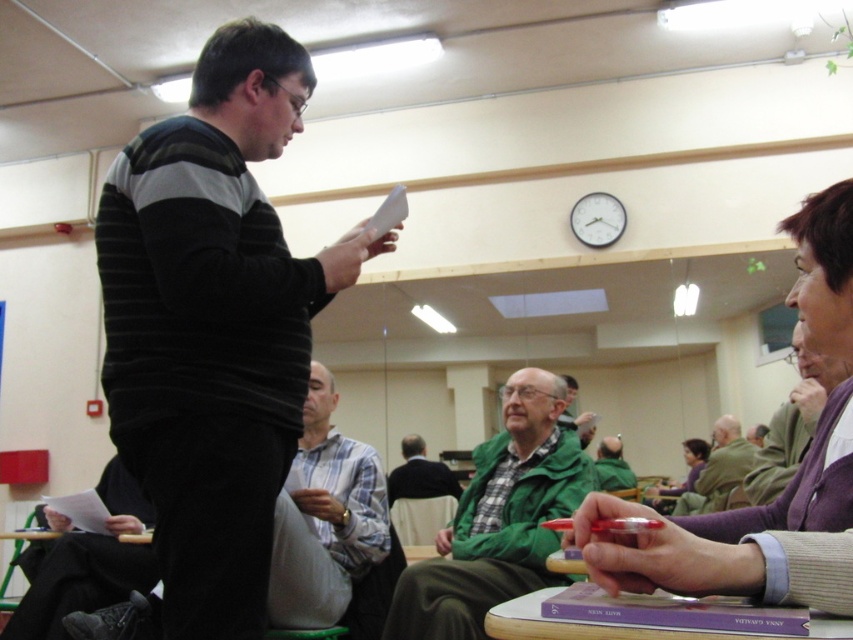
Question: Which point is closer to the camera taking this photo?

Choices:
 (A) (457, 573)
 (B) (322, 552)
 (C) (434, 497)

Answer: (A)

Question: Does green matte jacket at center have a larger size compared to green textured jacket at center?

Choices:
 (A) yes
 (B) no

Answer: (A)

Question: Based on their relative distances, which object is nearer to the green woolen sweater at center?

Choices:
 (A) striped sweater at center
 (B) white plaid shirt at center

Answer: (B)

Question: Does striped sweater at center come behind green textured jacket at center?

Choices:
 (A) yes
 (B) no

Answer: (B)

Question: Does green matte jacket at center have a larger size compared to white plaid shirt at center?

Choices:
 (A) no
 (B) yes

Answer: (B)

Question: Which object is farther from the camera taking this photo?

Choices:
 (A) green woolen sweater at center
 (B) white plaid shirt at center
 (C) knitted purple sweater at upper right
 (D) striped sweater at center

Answer: (A)